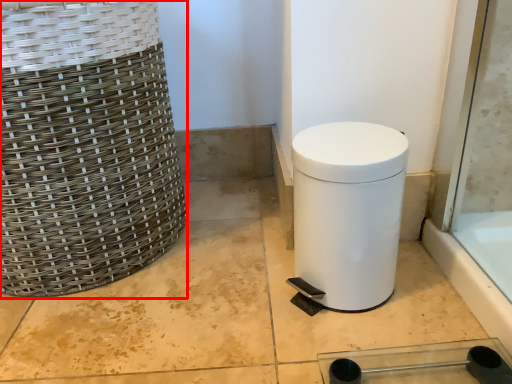
Question: From the image's perspective, what is the correct spatial positioning of basket (annotated by the red box) in reference to waste container?

Choices:
 (A) above
 (B) below

Answer: (A)